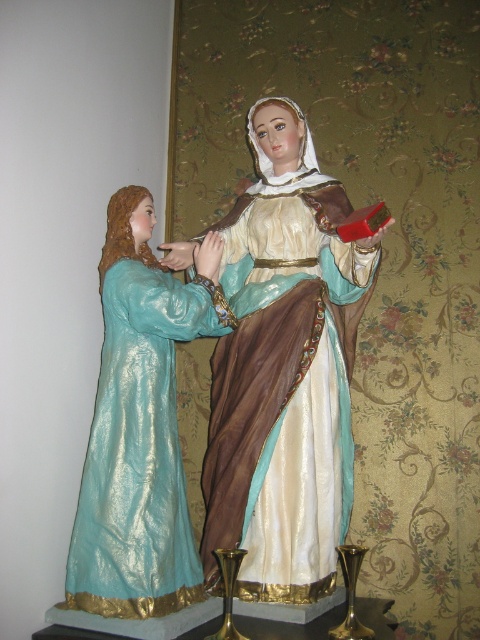
Locate an element on the screen. silky brown dress at center is located at coordinates (285, 387).

Does silky brown dress at center have a lesser width compared to shiny teal dress at left?

No, silky brown dress at center is not thinner than shiny teal dress at left.

Locate an element on the screen. Image resolution: width=480 pixels, height=640 pixels. silky brown dress at center is located at coordinates (285, 387).